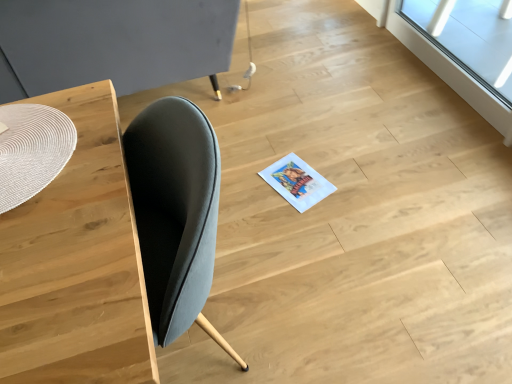
Question: Considering their positions, is matte woven placemat at left, the first round table when ordered from back to front, located in front of or behind transparent glass window at upper right?

Choices:
 (A) front
 (B) behind

Answer: (A)

Question: From their relative heights in the image, would you say matte woven placemat at left, the 2th round table positioned from the bottom, is taller or shorter than transparent glass window at upper right?

Choices:
 (A) short
 (B) tall

Answer: (B)

Question: Estimate the real-world distances between objects in this image. Which object is farther from the white woven placemat at left, which appears as the 1th round table when ordered from the bottom?

Choices:
 (A) transparent glass window at upper right
 (B) wooden table at left
 (C) matte woven placemat at left, the 2th round table positioned from the bottom

Answer: (A)

Question: Estimate the real-world distances between objects in this image. Which object is farther from the transparent glass window at upper right?

Choices:
 (A) wooden table at left
 (B) white woven placemat at left, which is the 1th round table in front-to-back order
 (C) matte woven placemat at left, the 2th round table positioned from the bottom

Answer: (B)